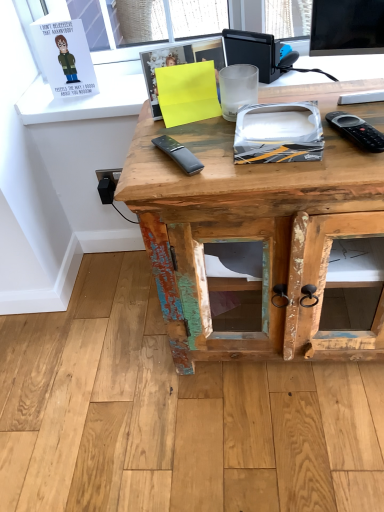
This screenshot has height=512, width=384. I want to click on vacant region in front of yellow paper at center, arranged as the second book when viewed from the back, so click(x=183, y=143).